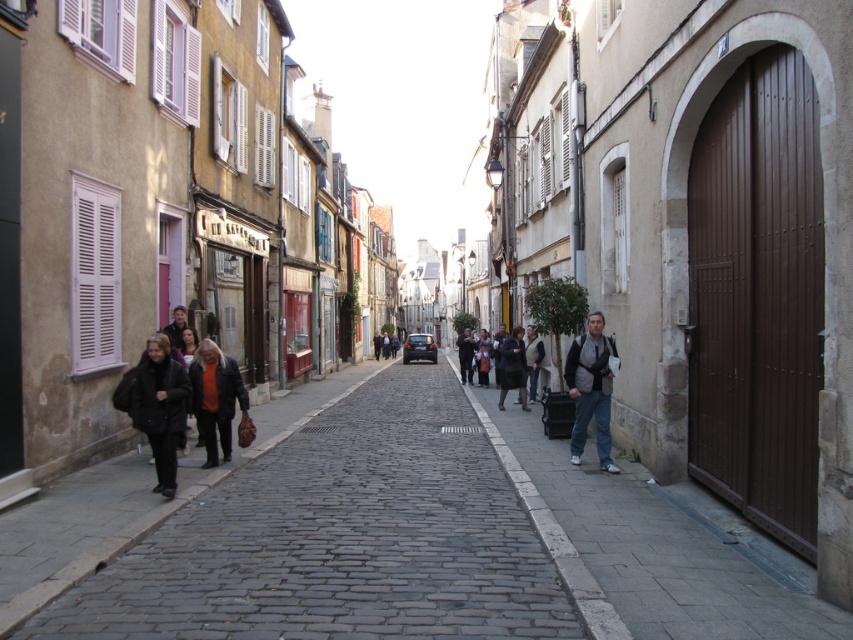
You are standing on a cobblestone street in a European town. You see an orange sweater at center and a camera. Which object is closer to you?

The orange sweater at center is closer to you since it is only 9.25 meters away from the camera, which is farther away.

You are standing on the cobblestone street and want to touch the point at coordinates (654, 545). Which object should you reach for?

The point at coordinates (654, 545) is located on the denim jacket at lower right, so you should reach for the denim jacket at lower right to touch that point.